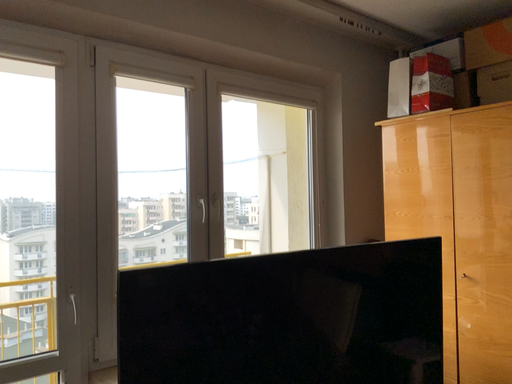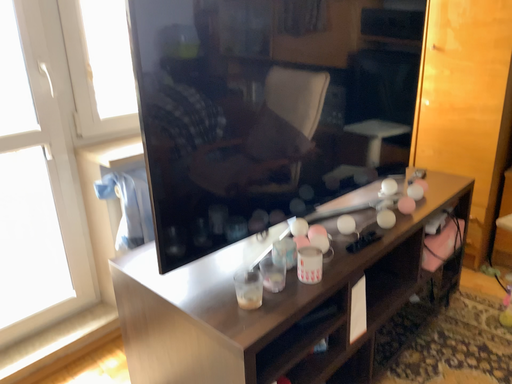
Question: Which way did the camera rotate in the video?

Choices:
 (A) rotated upward
 (B) rotated downward

Answer: (B)